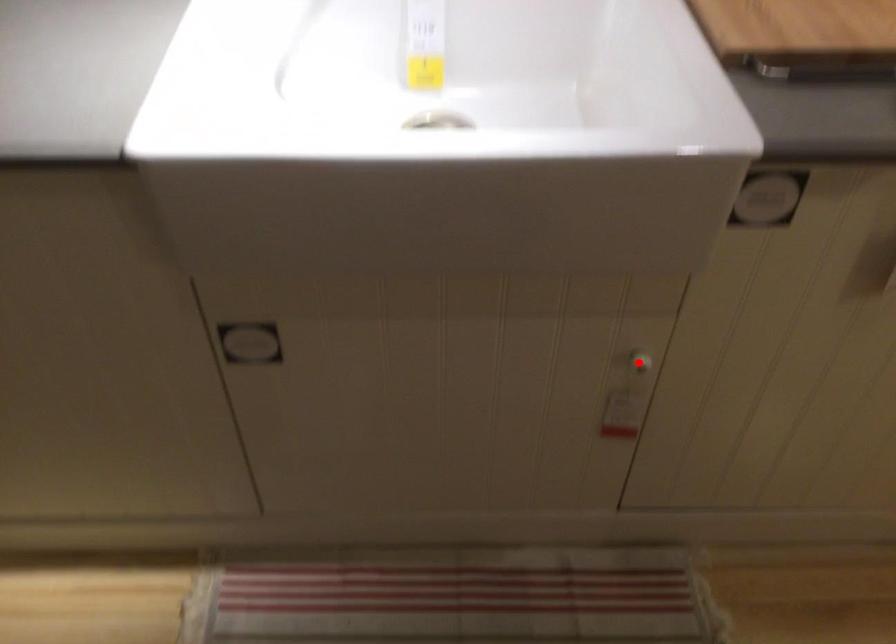
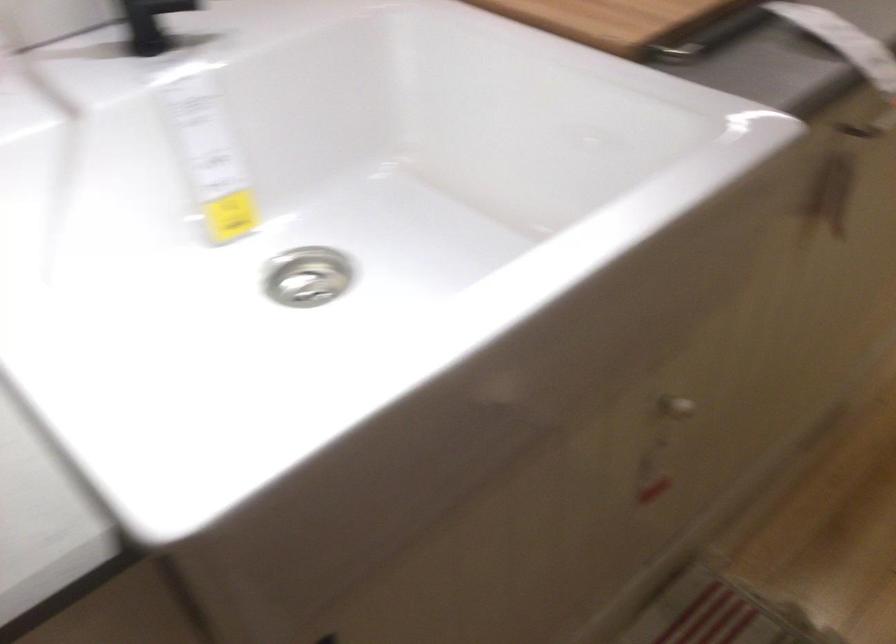
In the second image, find the point that corresponds to the highlighted location in the first image.

(675, 408)